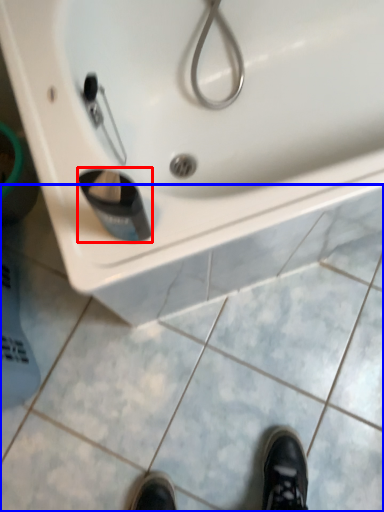
Question: Which of the following is the farthest to the observer, liquid (highlighted by a red box) or tile (highlighted by a blue box)?

Choices:
 (A) liquid
 (B) tile

Answer: (B)